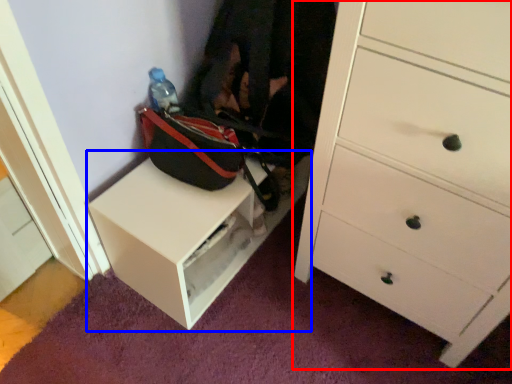
Question: Which point is closer to the camera, chest of drawers (highlighted by a red box) or table (highlighted by a blue box)?

Choices:
 (A) chest of drawers
 (B) table

Answer: (A)